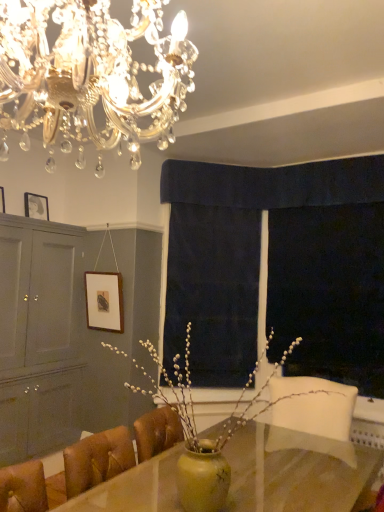
Question: From the image's perspective, would you say matte black picture frame at upper left, the 2th picture frame positioned from the top, is shown under dark blue velvet curtain at upper center, the second curtain when ordered from bottom to top?

Choices:
 (A) yes
 (B) no

Answer: (A)

Question: Is matte black picture frame at upper left, the 2th picture frame from the bottom, directly adjacent to dark blue velvet curtain at upper center, the 2th curtain viewed from the left?

Choices:
 (A) yes
 (B) no

Answer: (B)

Question: Can you confirm if matte black picture frame at upper left, positioned as the second picture frame in left-to-right order, is shorter than dark blue velvet curtain at upper center, marked as the 1th curtain in a right-to-left arrangement?

Choices:
 (A) no
 (B) yes

Answer: (B)

Question: Does matte black picture frame at upper left, placed as the second picture frame when sorted from right to left, have a greater height compared to dark blue velvet curtain at upper center, the second curtain when ordered from bottom to top?

Choices:
 (A) no
 (B) yes

Answer: (A)

Question: From a real-world perspective, is matte black picture frame at upper left, positioned as the second picture frame in left-to-right order, over dark blue velvet curtain at upper center, marked as the 1th curtain in a right-to-left arrangement?

Choices:
 (A) yes
 (B) no

Answer: (B)

Question: Is matte black picture frame at upper left, positioned as the second picture frame in left-to-right order, turned away from dark blue velvet curtain at upper center, acting as the first curtain starting from the top?

Choices:
 (A) no
 (B) yes

Answer: (A)

Question: Considering the relative sizes of matte gray cabinet at left and wooden picture frame at upper left, the 3th picture frame in the right-to-left sequence, in the image provided, is matte gray cabinet at left thinner than wooden picture frame at upper left, the 3th picture frame in the right-to-left sequence,?

Choices:
 (A) yes
 (B) no

Answer: (B)

Question: Is matte gray cabinet at left to the right of wooden picture frame at upper left, which is the 3th picture frame in bottom-to-top order, from the viewer's perspective?

Choices:
 (A) no
 (B) yes

Answer: (B)

Question: Is wooden picture frame at upper left, positioned as the 1th picture frame in left-to-right order, completely or partially inside matte gray cabinet at left?

Choices:
 (A) no
 (B) yes

Answer: (A)

Question: From a real-world perspective, is matte gray cabinet at left located higher than wooden picture frame at upper left, acting as the 1th picture frame starting from the top?

Choices:
 (A) yes
 (B) no

Answer: (B)

Question: Is matte gray cabinet at left facing towards wooden picture frame at upper left, positioned as the 1th picture frame in left-to-right order?

Choices:
 (A) no
 (B) yes

Answer: (A)

Question: Considering the relative sizes of matte gray cabinet at left and wooden picture frame at upper left, acting as the 1th picture frame starting from the top, in the image provided, is matte gray cabinet at left wider than wooden picture frame at upper left, acting as the 1th picture frame starting from the top,?

Choices:
 (A) no
 (B) yes

Answer: (B)

Question: Is wooden picture frame at upper left, the 3th picture frame in the right-to-left sequence, oriented away from dark blue velvet curtain at center, the 1th curtain from the left?

Choices:
 (A) no
 (B) yes

Answer: (A)